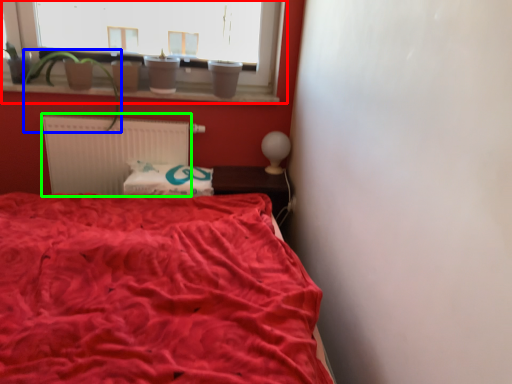
Question: Estimate the real-world distances between objects in this image. Which object is closer to window (highlighted by a red box), plant (highlighted by a blue box) or radiator (highlighted by a green box)?

Choices:
 (A) plant
 (B) radiator

Answer: (A)